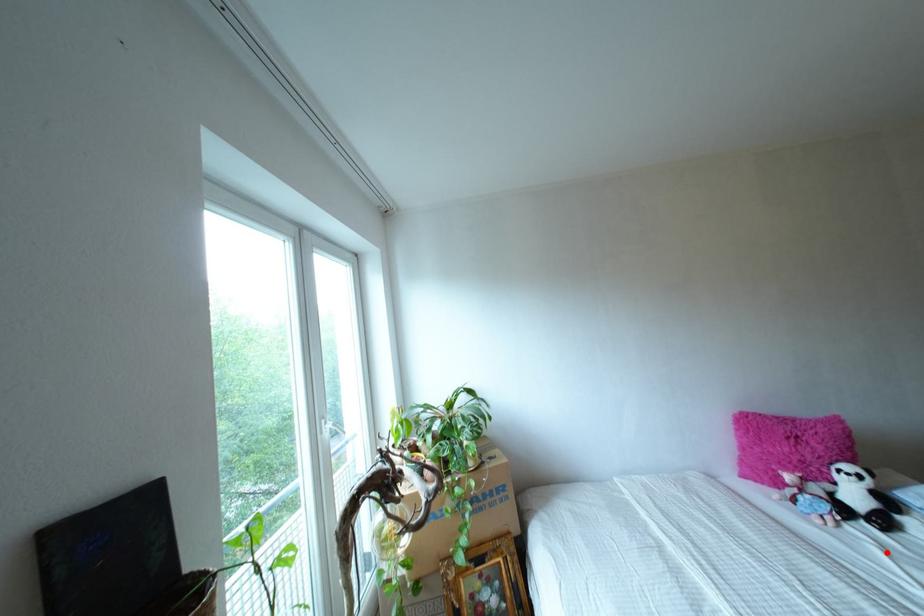
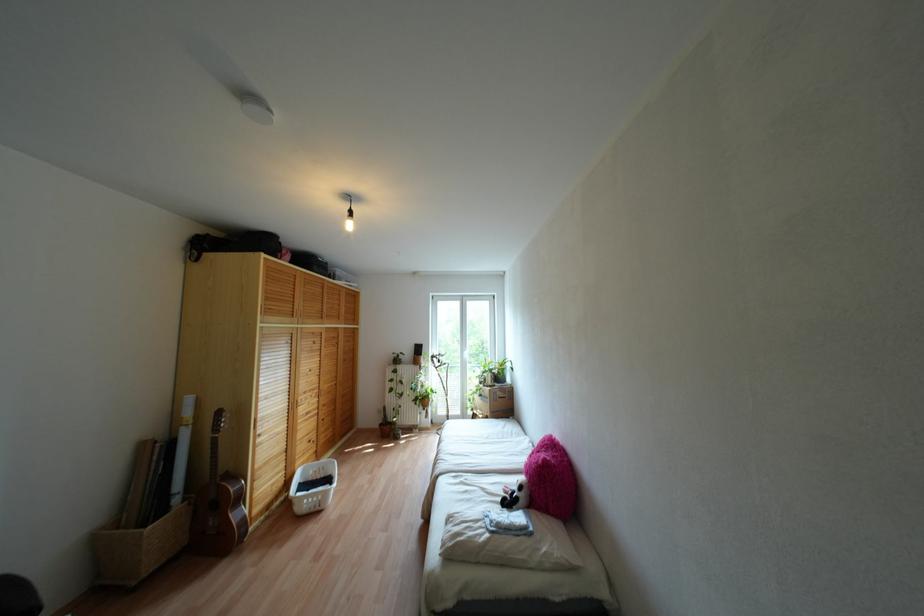
In the second image, find the point that corresponds to the highlighted location in the first image.

(482, 488)